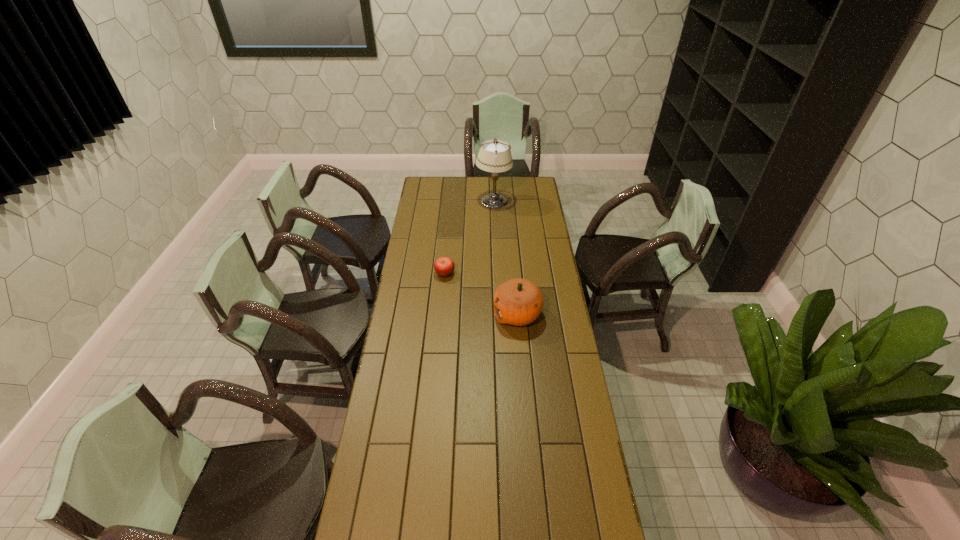
Where is `free location located 0.160m on the left of the apple`? This screenshot has width=960, height=540. free location located 0.160m on the left of the apple is located at coordinates (402, 273).

Find the location of a particular element. This screenshot has height=540, width=960. object located in the far edge section of the desktop is located at coordinates (494, 156).

Where is `object positioned at the left edge`? The width and height of the screenshot is (960, 540). object positioned at the left edge is located at coordinates (x=444, y=266).

Image resolution: width=960 pixels, height=540 pixels. Identify the location of object located in the right edge section of the desktop. (518, 302).

Identify the location of vacant space at the left edge of the desktop. (413, 400).

You are a GUI agent. You are given a task and a screenshot of the screen. Output one action in this format:
    pyautogui.click(x=<x>, y=<y>)
    Task: Click on the free space at the right edge of the desktop
    The width and height of the screenshot is (960, 540).
    Given the screenshot: What is the action you would take?
    pyautogui.click(x=534, y=335)

Find the location of a particular element. This screenshot has width=960, height=540. vacant space at the far left corner of the desktop is located at coordinates (431, 187).

At what (x,y) coordinates should I click in order to perform the action: click on empty space that is in between the shortest object and the pumpkin. Please return your answer as a coordinate pair (x, y). This screenshot has height=540, width=960. Looking at the image, I should click on tap(481, 294).

Where is `vacant space in between the tallest object and the nearest object`? This screenshot has width=960, height=540. vacant space in between the tallest object and the nearest object is located at coordinates (506, 258).

You are a GUI agent. You are given a task and a screenshot of the screen. Output one action in this format:
    pyautogui.click(x=<x>, y=<y>)
    Task: Click on the unoccupied position between the farthest object and the leftmost object
    The height and width of the screenshot is (540, 960).
    Given the screenshot: What is the action you would take?
    pyautogui.click(x=469, y=238)